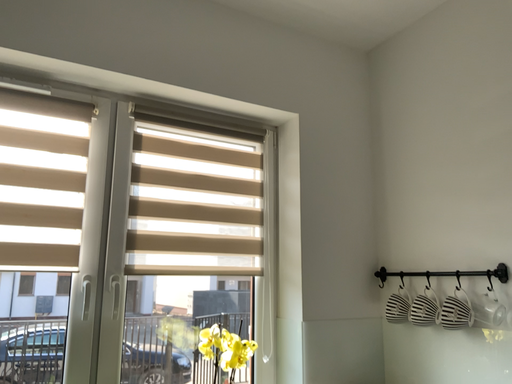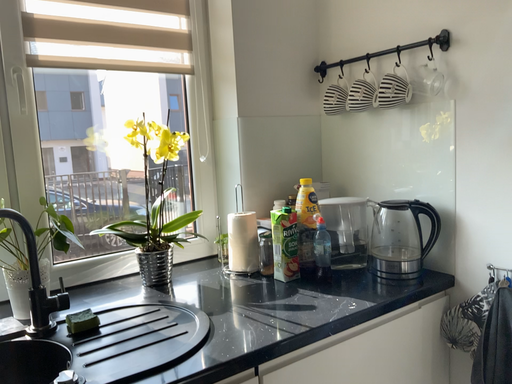
Question: How did the camera likely rotate when shooting the video?

Choices:
 (A) rotated left
 (B) rotated right

Answer: (B)